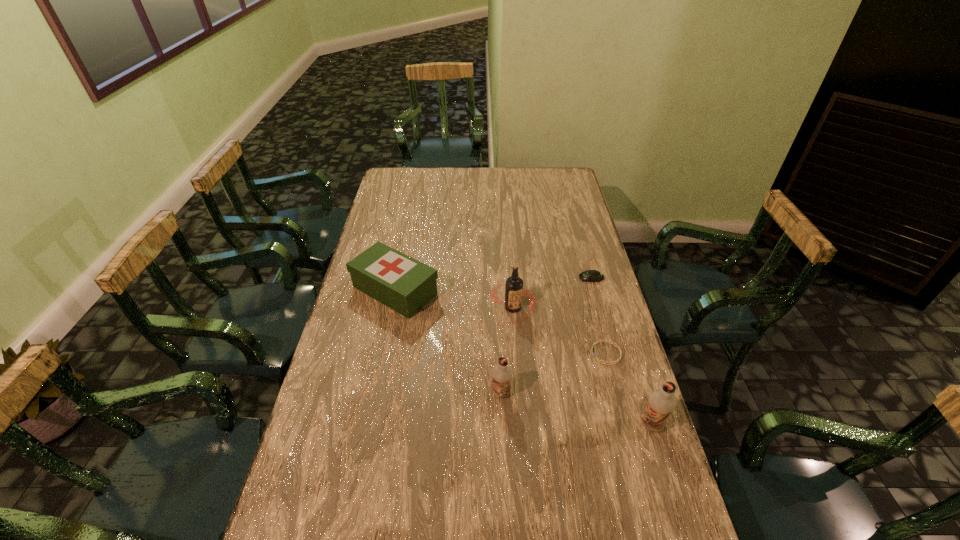
Locate an element on the screen. The width and height of the screenshot is (960, 540). the fourth shortest object is located at coordinates (501, 374).

Identify the location of the farther chocolate milk. (501, 374).

In order to click on the taller chocolate milk in this screenshot , I will do point(661,402).

At what (x,y) coordinates should I click in order to perform the action: click on the right chocolate milk. Please return your answer as a coordinate pair (x, y). The width and height of the screenshot is (960, 540). Looking at the image, I should click on (661, 402).

This screenshot has width=960, height=540. I want to click on root beer, so click(514, 290).

Locate an element on the screen. This screenshot has height=540, width=960. the fifth tallest object is located at coordinates (590, 275).

The height and width of the screenshot is (540, 960). In order to click on the shortest object in this screenshot , I will do [596, 342].

At what (x,y) coordinates should I click in order to perform the action: click on the fourth farthest object. Please return your answer as a coordinate pair (x, y). The height and width of the screenshot is (540, 960). Looking at the image, I should click on (596, 342).

Identify the location of the leftmost object. (402, 283).

Identify the location of the fourth tallest object. This screenshot has width=960, height=540. (402, 283).